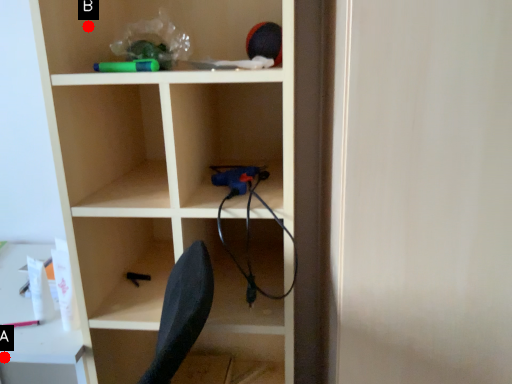
Question: Two points are circled on the image, labeled by A and B beside each circle. Which point appears farthest from the camera in this image?

Choices:
 (A) A is further
 (B) B is further

Answer: (A)